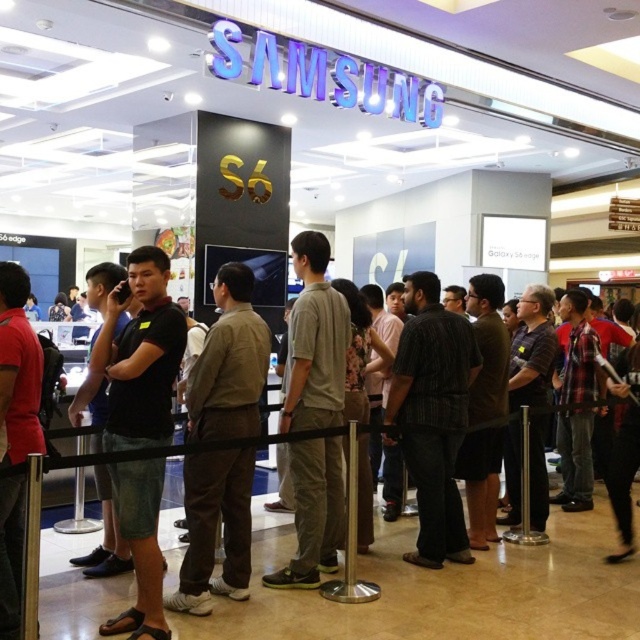
Which is in front, point (298, 497) or point (445, 520)?

Positioned in front is point (298, 497).

Is point (316, 253) farther from viewer compared to point (456, 518)?

No, (316, 253) is in front of (456, 518).

Is point (289, 314) farther from camera compared to point (420, 323)?

No, it is in front of (420, 323).

Find the location of `gray cotton shirt at center`. gray cotton shirt at center is located at coordinates (314, 340).

Is black cotton shirt at center to the left of matte black shirt at left from the viewer's perspective?

In fact, black cotton shirt at center is to the right of matte black shirt at left.

Looking at this image, which of these two, black cotton shirt at center or matte black shirt at left, stands taller?

Standing taller between the two is black cotton shirt at center.

I want to click on black cotton shirt at center, so coord(140,355).

Does brown cotton shirt at center appear under matte black shirt at left?

A: Correct, brown cotton shirt at center is located below matte black shirt at left.

Is brown cotton shirt at center above matte black shirt at left?

Incorrect, brown cotton shirt at center is not positioned above matte black shirt at left.

Which is in front, point (209, 490) or point (12, 436)?

Point (12, 436)

Locate an element on the screen. The height and width of the screenshot is (640, 640). brown cotton shirt at center is located at coordinates (228, 364).